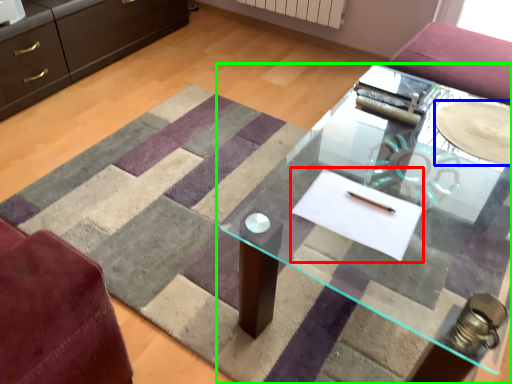
Question: Which object is the closest to the flat (highlighted by a red box)? Choose among these: glass plate (highlighted by a blue box) or table (highlighted by a green box).

Choices:
 (A) glass plate
 (B) table

Answer: (A)